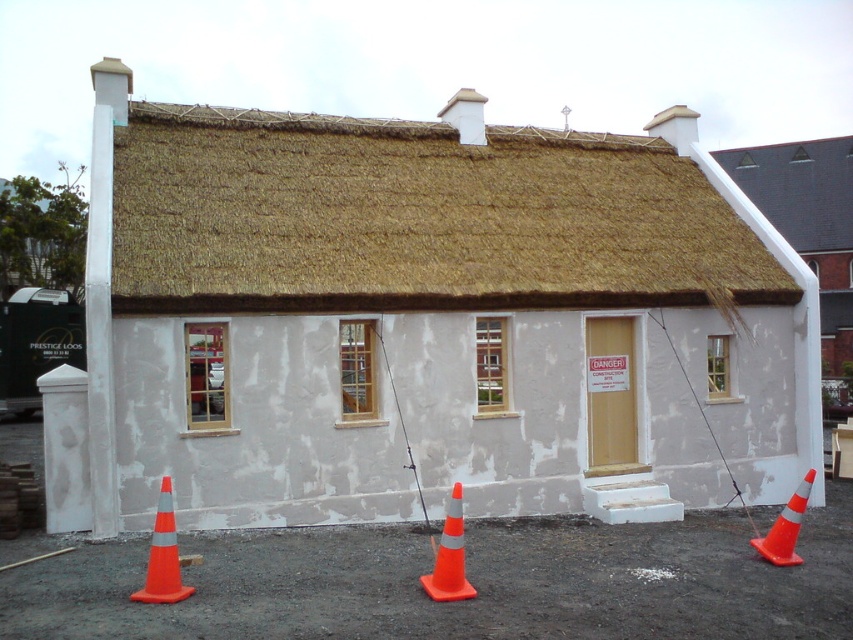
You are standing at the entrance of the small thatched building and want to place an orange cone somewhere in the lower center area. Is there space available at point (450, 556)?

Yes, there is space available at point (450, 556) because the orange cone is located there.

You are standing in front of the building and want to locate the white plastered hut at center. Based on the coordinates provided, where would you find it?

The white plastered hut at center is located at the coordinates point [422,321], which places it near the center of the image.